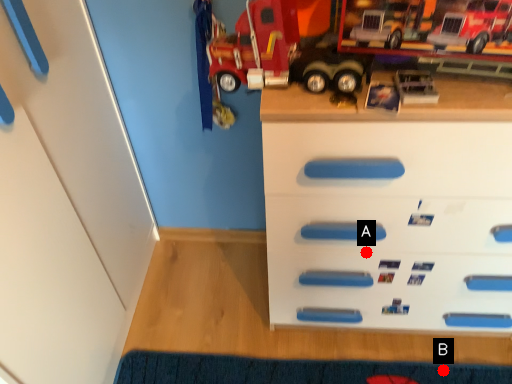
Question: Two points are circled on the image, labeled by A and B beside each circle. Which point is closer to the camera?

Choices:
 (A) A is closer
 (B) B is closer

Answer: (A)